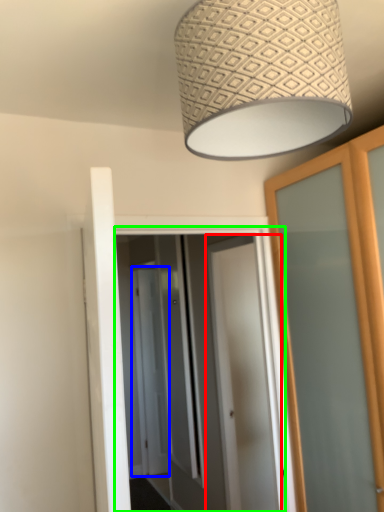
Question: Which object is the closest to the door (highlighted by a red box)? Choose among these: screen door (highlighted by a blue box) or screen door (highlighted by a green box).

Choices:
 (A) screen door
 (B) screen door

Answer: (B)